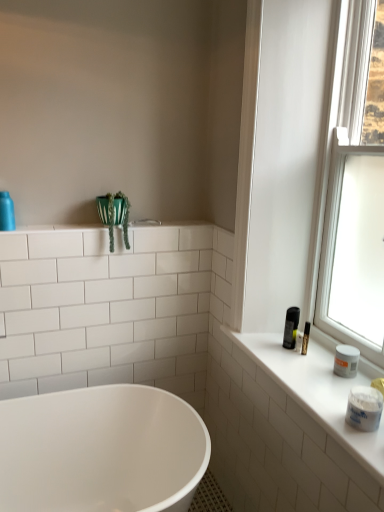
Question: Is green fabric plant at upper left aimed at white matte jar at right, which ranks as the second toiletry in top-to-bottom order?

Choices:
 (A) no
 (B) yes

Answer: (A)

Question: Could white matte jar at right, the 2th toiletry positioned from the left, be considered to be inside green fabric plant at upper left?

Choices:
 (A) yes
 (B) no

Answer: (B)

Question: From a real-world perspective, is green fabric plant at upper left positioned under white matte jar at right, the 2th toiletry positioned from the left, based on gravity?

Choices:
 (A) yes
 (B) no

Answer: (B)

Question: Does green fabric plant at upper left have a greater height compared to white matte jar at right, which appears as the 1th toiletry when viewed from the front?

Choices:
 (A) yes
 (B) no

Answer: (A)

Question: From a real-world perspective, is green fabric plant at upper left over white matte jar at right, which is the first toiletry from bottom to top?

Choices:
 (A) no
 (B) yes

Answer: (B)

Question: Looking at their shapes, would you say matte blue bottle at upper left, the first toiletry viewed from the top, is wider or thinner than green fabric plant at upper left?

Choices:
 (A) wide
 (B) thin

Answer: (B)

Question: Is matte blue bottle at upper left, the first toiletry viewed from the top, in front of or behind green fabric plant at upper left in the image?

Choices:
 (A) front
 (B) behind

Answer: (A)

Question: Is matte blue bottle at upper left, the first toiletry viewed from the top, spatially inside green fabric plant at upper left, or outside of it?

Choices:
 (A) outside
 (B) inside

Answer: (A)

Question: Considering the positions of matte blue bottle at upper left, the first toiletry viewed from the top, and green fabric plant at upper left in the image, is matte blue bottle at upper left, the first toiletry viewed from the top, bigger or smaller than green fabric plant at upper left?

Choices:
 (A) big
 (B) small

Answer: (B)

Question: Is matte blue bottle at upper left, which is the 1th toiletry from left to right, in front of or behind white matte jar at right, acting as the first toiletry starting from the right, in the image?

Choices:
 (A) behind
 (B) front

Answer: (A)

Question: From a real-world perspective, relative to white matte jar at right, acting as the first toiletry starting from the right, is matte blue bottle at upper left, which is counted as the second toiletry, starting from the right, vertically above or below?

Choices:
 (A) below
 (B) above

Answer: (B)

Question: Does point (11, 218) appear closer or farther from the camera than point (367, 416)?

Choices:
 (A) closer
 (B) farther

Answer: (B)

Question: Do you think matte blue bottle at upper left, the 2th toiletry from the front, is within white matte jar at right, acting as the first toiletry starting from the right, or outside of it?

Choices:
 (A) inside
 (B) outside

Answer: (B)

Question: Based on their positions, is transparent glass window at upper right located to the left or right of green fabric plant at upper left?

Choices:
 (A) left
 (B) right

Answer: (B)

Question: Does point (349, 1) appear closer or farther from the camera than point (124, 216)?

Choices:
 (A) farther
 (B) closer

Answer: (B)